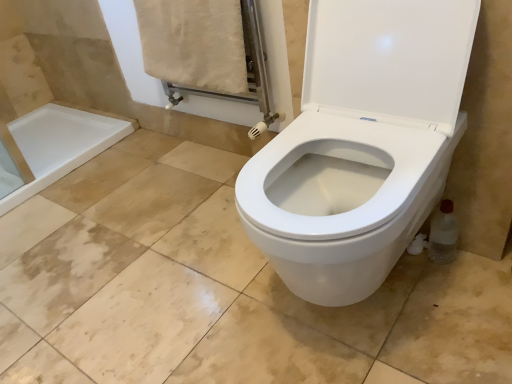
Question: From the image's perspective, is clear plastic bottle at lower right positioned above or below beige cotton towel at upper left?

Choices:
 (A) below
 (B) above

Answer: (A)

Question: Is clear plastic bottle at lower right in front of or behind beige cotton towel at upper left in the image?

Choices:
 (A) front
 (B) behind

Answer: (A)

Question: From a real-world perspective, is clear plastic bottle at lower right positioned above or below beige cotton towel at upper left?

Choices:
 (A) below
 (B) above

Answer: (A)

Question: Is beige cotton towel at upper left bigger or smaller than clear plastic bottle at lower right?

Choices:
 (A) big
 (B) small

Answer: (A)

Question: From a real-world perspective, is beige cotton towel at upper left positioned above or below clear plastic bottle at lower right?

Choices:
 (A) below
 (B) above

Answer: (B)

Question: Which is correct: beige cotton towel at upper left is inside clear plastic bottle at lower right, or outside of it?

Choices:
 (A) outside
 (B) inside

Answer: (A)

Question: Considering the positions of point (225, 1) and point (456, 221), is point (225, 1) closer or farther from the camera than point (456, 221)?

Choices:
 (A) farther
 (B) closer

Answer: (A)